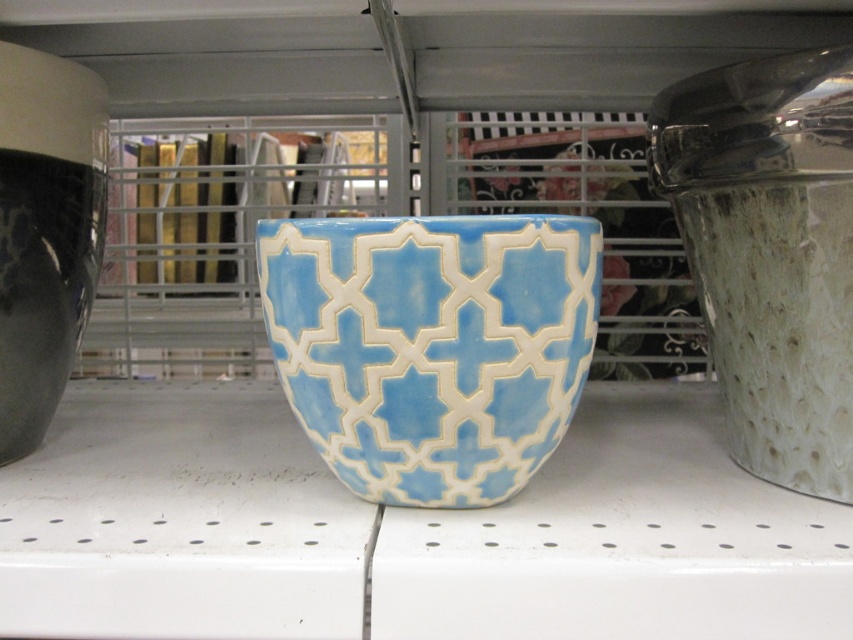
Question: Is light blue glazed bowl at center below matte black vase at left?

Choices:
 (A) yes
 (B) no

Answer: (A)

Question: Which object is closer to the camera taking this photo?

Choices:
 (A) light blue glazed bowl at center
 (B) textured glass jar at right
 (C) matte black vase at left

Answer: (A)

Question: Is light blue glazed bowl at center bigger than textured glass jar at right?

Choices:
 (A) yes
 (B) no

Answer: (B)

Question: Which object appears closest to the camera in this image?

Choices:
 (A) light blue glazed bowl at center
 (B) matte black vase at left
 (C) textured glass jar at right

Answer: (A)

Question: Among these points, which one is farthest from the camera?

Choices:
 (A) (68, 60)
 (B) (775, 282)

Answer: (A)

Question: Does textured glass jar at right have a greater width compared to matte black vase at left?

Choices:
 (A) no
 (B) yes

Answer: (B)